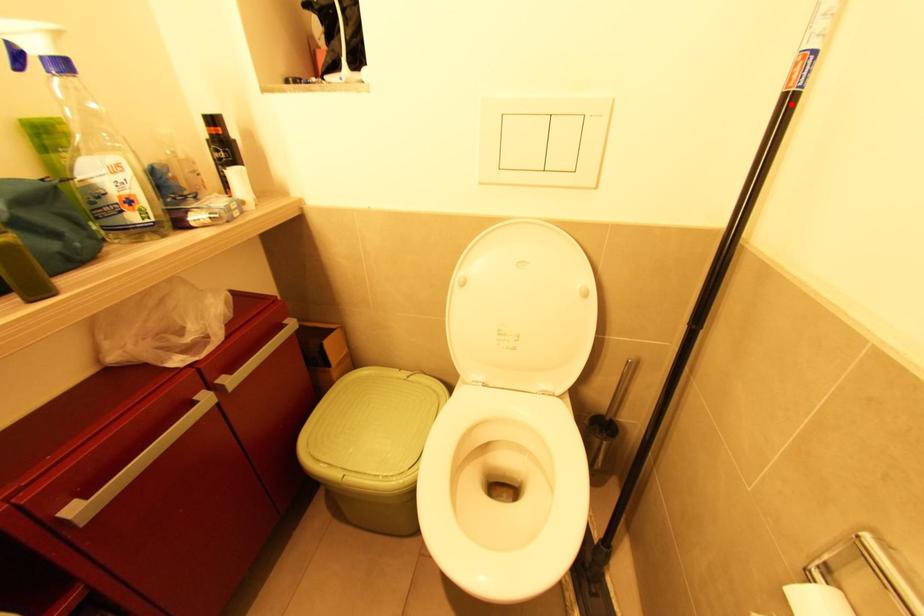
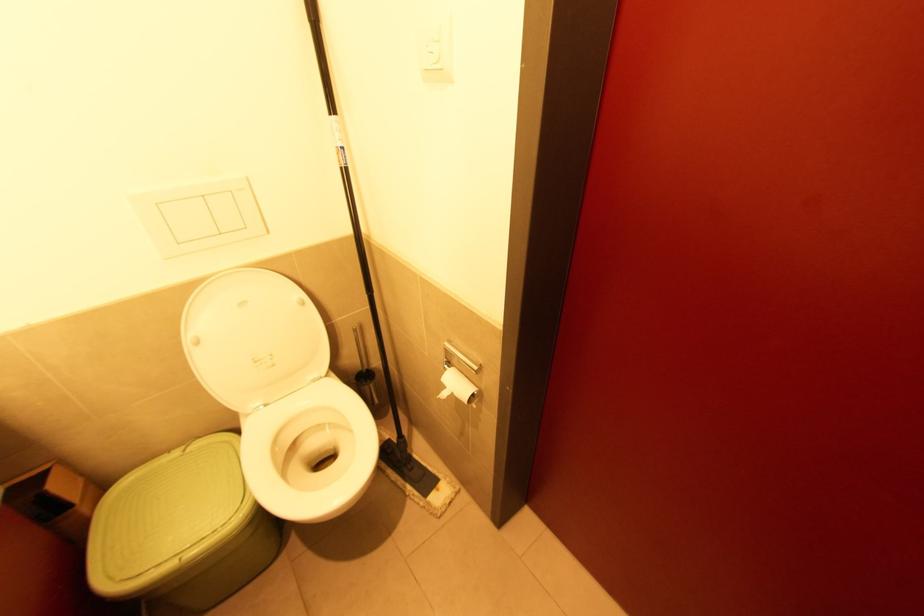
Where in the second image is the point corresponding to the highlighted location from the first image?

(347, 172)